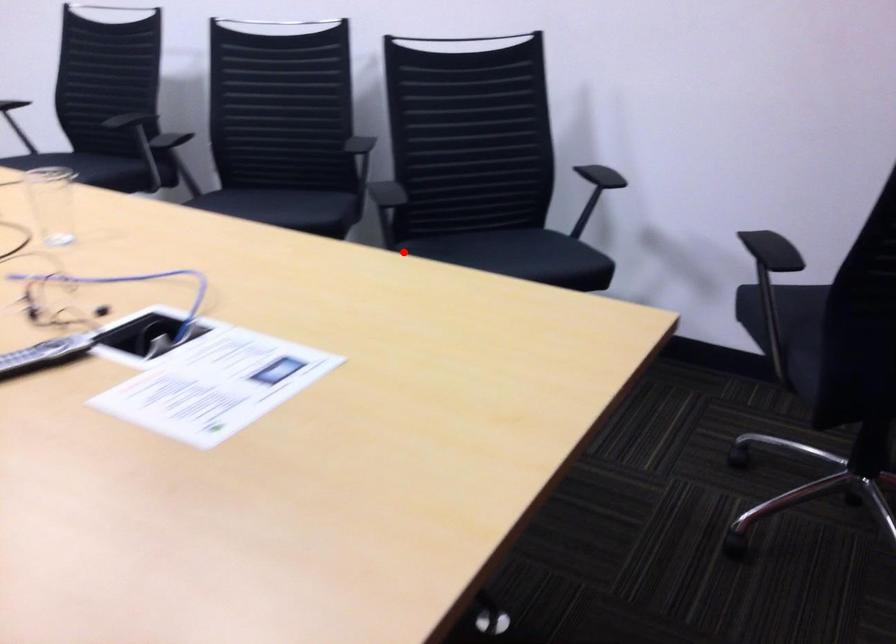
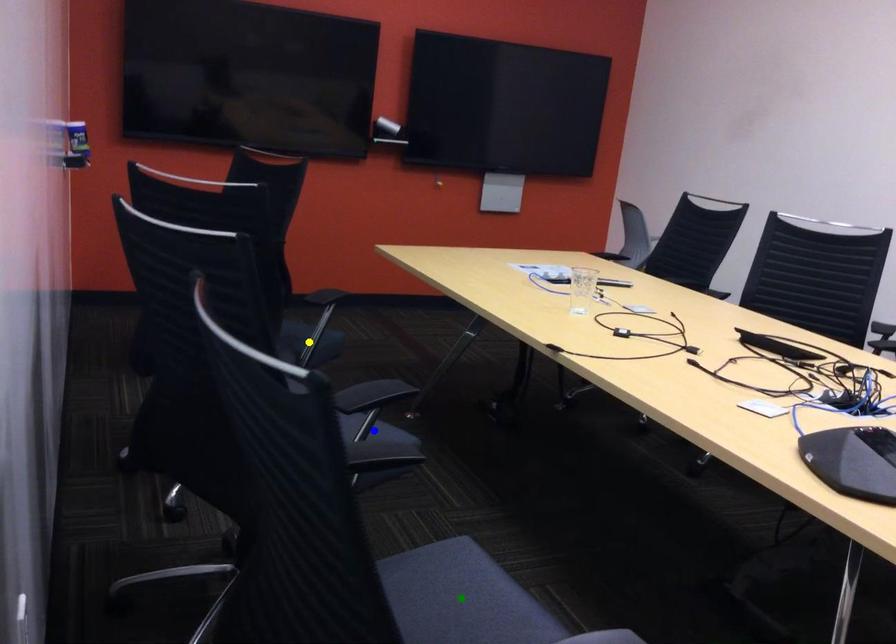
Question: I am providing you with two images of the same scene from different viewpoints. A red point is marked on the first image. You are given multiple points on the second image. Which spot in image 2 lines up with the point in image 1?

Choices:
 (A) yellow point
 (B) green point
 (C) blue point

Answer: (A)